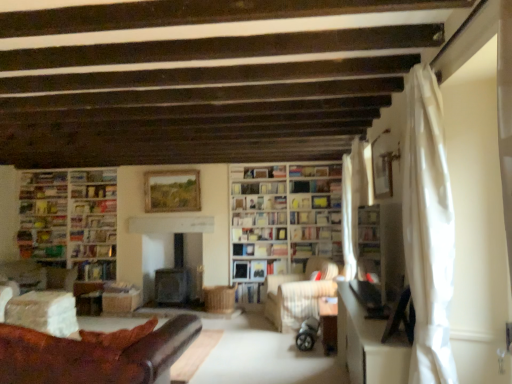
You are a GUI agent. You are given a task and a screenshot of the screen. Output one action in this format:
    pyautogui.click(x=<x>, y=<y>)
    Task: Click on the wooden bookshelf at center, the 1th shelf positioned from the back
    
    Given the screenshot: What is the action you would take?
    pyautogui.click(x=258, y=188)

What is the approximate width of hardcover book at center, the third book from the left?

hardcover book at center, the third book from the left, is 21.92 centimeters in width.

This screenshot has width=512, height=384. What do you see at coordinates (347, 220) in the screenshot?
I see `white sheer curtain at right, the third curtain when ordered from front to back` at bounding box center [347, 220].

The width and height of the screenshot is (512, 384). Find the location of `wooden bookshelf at center, arranged as the second shelf when viewed from the top`. wooden bookshelf at center, arranged as the second shelf when viewed from the top is located at coordinates (258, 188).

Based on the photo, is hardcover book at center, which is counted as the first book, starting from the right, spatially inside wooden picture frame at center, or outside of it?

hardcover book at center, which is counted as the first book, starting from the right, lies outside wooden picture frame at center.

From a real-world perspective, is hardcover book at center, which is counted as the first book, starting from the right, positioned under wooden picture frame at center based on gravity?

Yes.

Based on their sizes in the image, would you say hardcover book at center, which is counted as the first book, starting from the right, is bigger or smaller than wooden picture frame at center?

In the image, hardcover book at center, which is counted as the first book, starting from the right, appears to be smaller than wooden picture frame at center.

Is point (295, 240) closer to camera compared to point (162, 210)?

Yes.

Does point (89, 273) appear closer or farther from the camera than point (247, 193)?

Point (89, 273) appears to be closer to the viewer than point (247, 193).

Looking at this image, which object is wider, hardcover book at left, placed as the 6th book when sorted from right to left, or wooden bookshelf at center, marked as the third shelf in a right-to-left arrangement?

hardcover book at left, placed as the 6th book when sorted from right to left, is wider.

Are hardcover book at left, placed as the 6th book when sorted from right to left, and wooden bookshelf at center, the third shelf when ordered from front to back, making contact?

No, hardcover book at left, placed as the 6th book when sorted from right to left, is not next to wooden bookshelf at center, the third shelf when ordered from front to back.

Image resolution: width=512 pixels, height=384 pixels. I want to click on curtain in front of the white glossy bookshelf at right, which is counted as the 3th shelf, starting from the top, so click(428, 229).

How many degrees apart are the facing directions of white glossy bookshelf at right, placed as the 3th shelf when sorted from left to right, and white sheer curtain at right, which appears as the first curtain when viewed from the front?

1.75 degrees.

Considering the relative positions of white glossy bookshelf at right, the third shelf from the back, and white sheer curtain at right, acting as the 3th curtain starting from the back, in the image provided, is white glossy bookshelf at right, the third shelf from the back, to the right of white sheer curtain at right, acting as the 3th curtain starting from the back, from the viewer's perspective?

Indeed, white glossy bookshelf at right, the third shelf from the back, is positioned on the right side of white sheer curtain at right, acting as the 3th curtain starting from the back.

Does white glossy bookshelf at right, the first shelf viewed from the right, turn towards white sheer curtain at right, which appears as the first curtain when viewed from the front?

No, white glossy bookshelf at right, the first shelf viewed from the right, is not aimed at white sheer curtain at right, which appears as the first curtain when viewed from the front.

Considering the relative sizes of wooden bookshelf at center, the 2th shelf viewed from the back, and black rubber baby carriage at center in the image provided, is wooden bookshelf at center, the 2th shelf viewed from the back, wider than black rubber baby carriage at center?

No, wooden bookshelf at center, the 2th shelf viewed from the back, is not wider than black rubber baby carriage at center.

Is the surface of wooden bookshelf at center, the 2th shelf viewed from the back, in direct contact with black rubber baby carriage at center?

wooden bookshelf at center, the 2th shelf viewed from the back, and black rubber baby carriage at center are not in contact.

From the image's perspective, is wooden bookshelf at center, arranged as the second shelf when viewed from the right, over black rubber baby carriage at center?

Indeed, from the image's perspective, wooden bookshelf at center, arranged as the second shelf when viewed from the right, is shown above black rubber baby carriage at center.

From the image's perspective, between hardcover book at center, which is counted as the first book, starting from the right, and hardcover book at center, the third book from the left, which one is located above?

hardcover book at center, which is counted as the first book, starting from the right.

Consider the image. Is hardcover book at center, the seventh book when ordered from left to right, wider than hardcover book at center, the fifth book viewed from the right?

No.

Considering the sizes of objects hardcover book at center, which is counted as the first book, starting from the right, and hardcover book at center, the fifth book viewed from the right, in the image provided, who is smaller, hardcover book at center, which is counted as the first book, starting from the right, or hardcover book at center, the fifth book viewed from the right,?

hardcover book at center, which is counted as the first book, starting from the right.

In the scene shown: From a real-world perspective, relative to hardcover book at center, the third book from the left, is hardcover book at center, which is counted as the first book, starting from the right, vertically above or below?

From a real-world perspective, hardcover book at center, which is counted as the first book, starting from the right, is physically above hardcover book at center, the third book from the left.

I want to click on the 3rd curtain positioned above the black rubber baby carriage at center (from the image's perspective), so click(x=428, y=229).

Based on their sizes in the image, would you say white sheer curtain at right, acting as the 3th curtain starting from the back, is bigger or smaller than black rubber baby carriage at center?

In the image, white sheer curtain at right, acting as the 3th curtain starting from the back, appears to be larger than black rubber baby carriage at center.

Is white sheer curtain at right, acting as the 3th curtain starting from the back, at the left side of black rubber baby carriage at center?

No, white sheer curtain at right, acting as the 3th curtain starting from the back, is not to the left of black rubber baby carriage at center.

Would you say white sheer curtain at right, which appears as the first curtain when viewed from the front, is inside or outside black rubber baby carriage at center?

white sheer curtain at right, which appears as the first curtain when viewed from the front, lies outside black rubber baby carriage at center.

Is point (284, 188) closer or farther from the camera than point (83, 182)?

Clearly, point (284, 188) is more distant from the camera than point (83, 182).

Which is in front, wooden bookshelf at center, the third shelf when ordered from front to back, or white glossy bookcase at left, the 1th bookcase from the left?

Positioned in front is wooden bookshelf at center, the third shelf when ordered from front to back.

How many degrees apart are the facing directions of wooden bookshelf at center, the 1th shelf positioned from the back, and white glossy bookcase at left, acting as the 2th bookcase starting from the right?

1.2 degrees.

How much distance is there between wooden bookshelf at center, marked as the third shelf in a right-to-left arrangement, and white glossy bookcase at left, the 1th bookcase from the left?

2.31 meters.

Image resolution: width=512 pixels, height=384 pixels. I want to click on the 3rd book located beneath the wooden picture frame at center (from a real-world perspective), so click(x=315, y=233).

Locate an element on the screen. This screenshot has height=384, width=512. book that is the 6th one when counting downward from the wooden bookshelf at center, arranged as the second shelf when viewed from the top (from the image's perspective) is located at coordinates coord(96,270).

Which object lies nearer to the anchor point wooden bookshelf at center, the 1th shelf positioned from the back, white glossy bookshelf at right, which is counted as the 1th shelf, starting from the front, or wooden bookshelf at center, which ranks as the second shelf in front-to-back order?

wooden bookshelf at center, which ranks as the second shelf in front-to-back order, lies closer to wooden bookshelf at center, the 1th shelf positioned from the back, than the other object.

Which object lies nearer to the anchor point wooden bookshelf at center, the 2th shelf ordered from the bottom, white sheer curtain at right, which is counted as the 1th curtain, starting from the back, or white glossy table at right, which is the second table from back to front?

white sheer curtain at right, which is counted as the 1th curtain, starting from the back, is positioned closer to the anchor wooden bookshelf at center, the 2th shelf ordered from the bottom.

Looking at the image, which one is located closer to white sheer curtain at right, which is counted as the 1th curtain, starting from the back, white sheer curtain at right, which appears as the first curtain when viewed from the front, or hardcover book at center, which is the 5th book from left to right?

hardcover book at center, which is the 5th book from left to right, lies closer to white sheer curtain at right, which is counted as the 1th curtain, starting from the back, than the other object.

Based on their spatial positions, is white glossy bookcase at left, acting as the 2th bookcase starting from the right, or white glossy table at right, marked as the 1th table in a front-to-back arrangement, closer to white sheer curtain at right, acting as the 3th curtain starting from the back?

The object closer to white sheer curtain at right, acting as the 3th curtain starting from the back, is white glossy table at right, marked as the 1th table in a front-to-back arrangement.

From the image, which object appears to be nearer to hardcover book at center, which is counted as the first book, starting from the right, hardcover book at center, the 3th book from the right, or wooden table at lower center, which ranks as the second table in front-to-back order?

hardcover book at center, the 3th book from the right, is closer to hardcover book at center, which is counted as the first book, starting from the right.

From the image, which object appears to be nearer to hardcover book at center, the 3th book from the right, white glossy table at right, which is the second table from back to front, or hardcover book at left, the 2th book from the left?

hardcover book at left, the 2th book from the left, is closer to hardcover book at center, the 3th book from the right.

Based on their spatial positions, is hardcover book at center, the fifth book viewed from the right, or hardcover book at center, which is counted as the first book, starting from the right, further from hardcover book at center, which is the 5th book from left to right?

hardcover book at center, the fifth book viewed from the right, is further to hardcover book at center, which is the 5th book from left to right.

Based on their spatial positions, is wooden table at lower center, the first table when ordered from back to front, or hardcover book at center, placed as the first book when sorted from left to right, further from white paper bookshelf at center, acting as the 4th book starting from the left?

The object further to white paper bookshelf at center, acting as the 4th book starting from the left, is hardcover book at center, placed as the first book when sorted from left to right.

Locate an element on the screen. Image resolution: width=512 pixels, height=384 pixels. shelf located between wooden table at lower center, the first table when ordered from back to front, and wooden bookshelf at center, arranged as the second shelf when viewed from the top, in the depth direction is located at coordinates (315, 186).

Where is `curtain between black rubber baby carriage at center and hardcover book at center, which is the 5th book from left to right, along the z-axis`? curtain between black rubber baby carriage at center and hardcover book at center, which is the 5th book from left to right, along the z-axis is located at coordinates (347, 220).

The width and height of the screenshot is (512, 384). Identify the location of bookcase located between leather couch at lower left and wooden bookshelf at center, the 2th shelf viewed from the back, in the depth direction. (287, 218).

Image resolution: width=512 pixels, height=384 pixels. I want to click on baby carriage between white sheer curtain at right, the 2th curtain from the front, and light beige fabric chair at center in the front-back direction, so click(x=307, y=334).